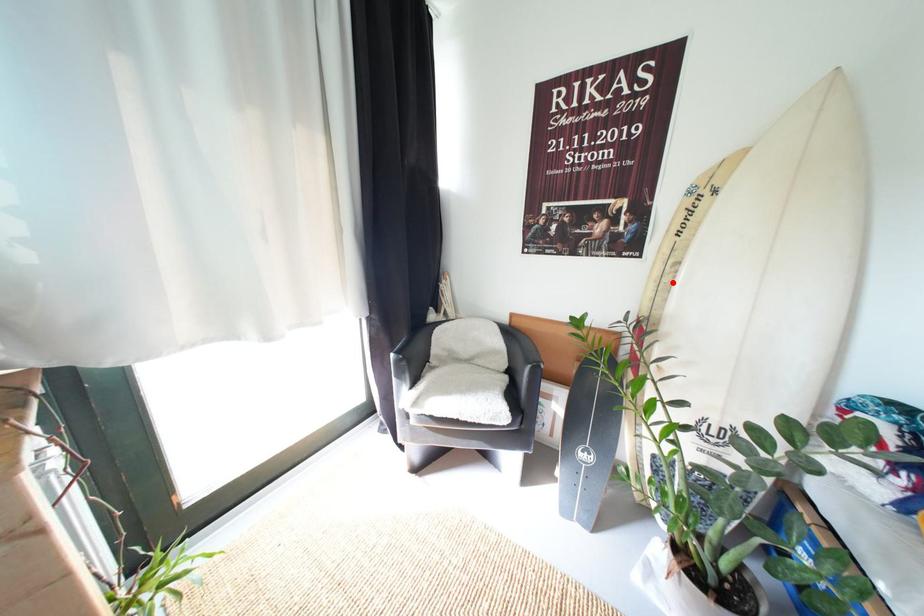
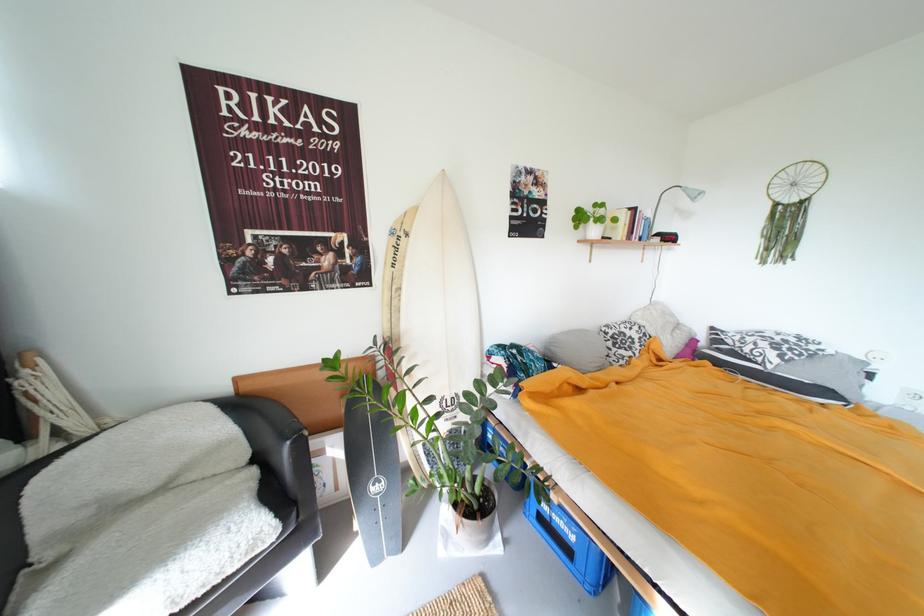
Where in the second image is the point corresponding to the highlighted location from the first image?

(402, 306)